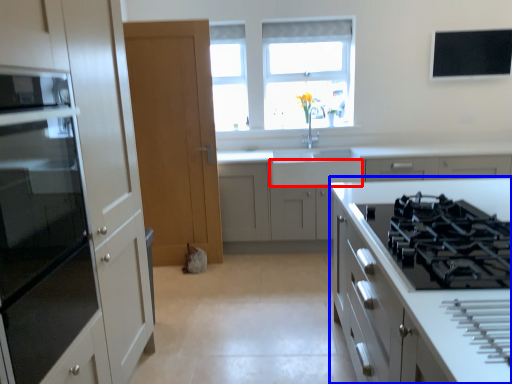
Question: Among these objects, which one is nearest to the camera, drawer (highlighted by a red box) or cabinetry (highlighted by a blue box)?

Choices:
 (A) drawer
 (B) cabinetry

Answer: (B)